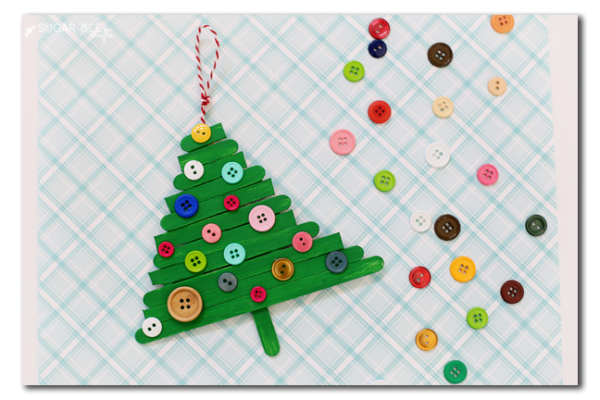
Where is `christmas tree`? This screenshot has width=600, height=400. christmas tree is located at coordinates (232, 304).